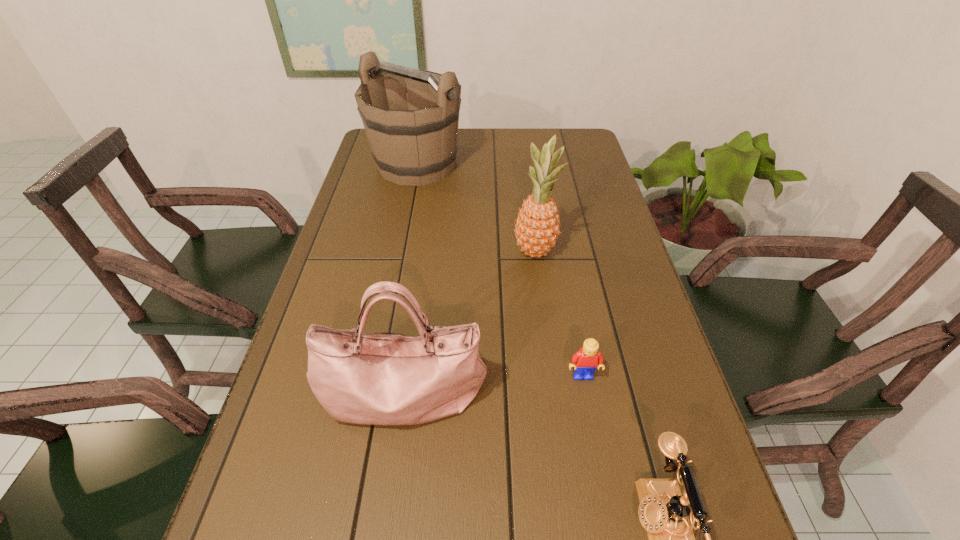
At what (x,y) coordinates should I click in order to perform the action: click on object that is the fourth closest to the handbag. Please return your answer as a coordinate pair (x, y). The width and height of the screenshot is (960, 540). Looking at the image, I should click on (413, 141).